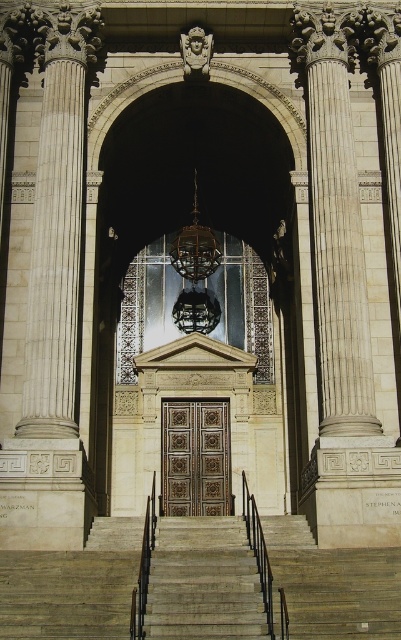
Can you confirm if gray stone stairs at center is shorter than gold ornate door at center?

Indeed, gray stone stairs at center has a lesser height compared to gold ornate door at center.

Which is behind, point (301, 608) or point (222, 451)?

Positioned behind is point (222, 451).

Which is in front, point (44, 616) or point (192, 449)?

Point (44, 616)

Where is `gray stone stairs at center`? The height and width of the screenshot is (640, 401). gray stone stairs at center is located at coordinates (72, 586).

Is point (34, 241) closer to camera compared to point (226, 438)?

Yes, it is in front of point (226, 438).

You are a GUI agent. You are given a task and a screenshot of the screen. Output one action in this format:
    pyautogui.click(x=<x>, y=<y>)
    Task: Click on the white marble column at left
    The height and width of the screenshot is (640, 401).
    Given the screenshot: What is the action you would take?
    pyautogui.click(x=54, y=257)

Can you confirm if gray stone stairs at center is positioned above white marble column at left?

No, gray stone stairs at center is not above white marble column at left.

Image resolution: width=401 pixels, height=640 pixels. What do you see at coordinates (72, 586) in the screenshot?
I see `gray stone stairs at center` at bounding box center [72, 586].

Does point (192, 580) come closer to viewer compared to point (74, 209)?

Yes.

Find the location of `gray stone stairs at center`. gray stone stairs at center is located at coordinates (72, 586).